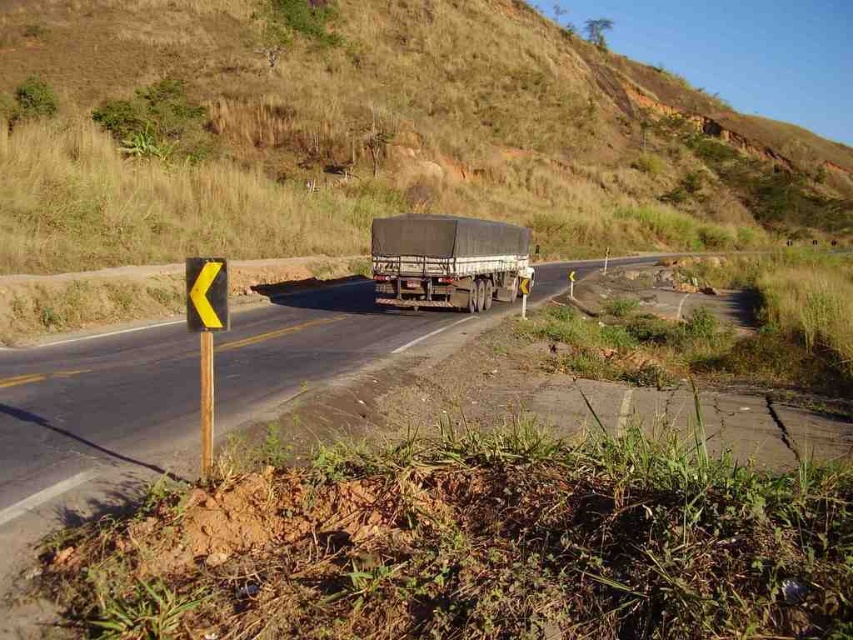
Question: Which is farther from the yellow plastic traffic sign at left?

Choices:
 (A) dark gray matte trailer truck at center
 (B) yellow plastic sign at left
 (C) brown grassy hillside at upper center

Answer: (C)

Question: Can you confirm if dark gray matte trailer truck at center is bigger than yellow plastic sign at left?

Choices:
 (A) yes
 (B) no

Answer: (A)

Question: Which of the following is the closest to the observer?

Choices:
 (A) yellow plastic traffic sign at left
 (B) yellow plastic sign at left
 (C) dark gray matte trailer truck at center

Answer: (B)

Question: Is dark gray matte trailer truck at center to the left of yellow plastic sign at left from the viewer's perspective?

Choices:
 (A) yes
 (B) no

Answer: (B)

Question: Can you confirm if dark gray matte trailer truck at center is thinner than yellow plastic traffic sign at left?

Choices:
 (A) no
 (B) yes

Answer: (A)

Question: Which of the following is the farthest from the observer?

Choices:
 (A) brown grassy hillside at upper center
 (B) dark gray matte trailer truck at center
 (C) yellow plastic sign at left
 (D) yellow plastic traffic sign at left

Answer: (B)